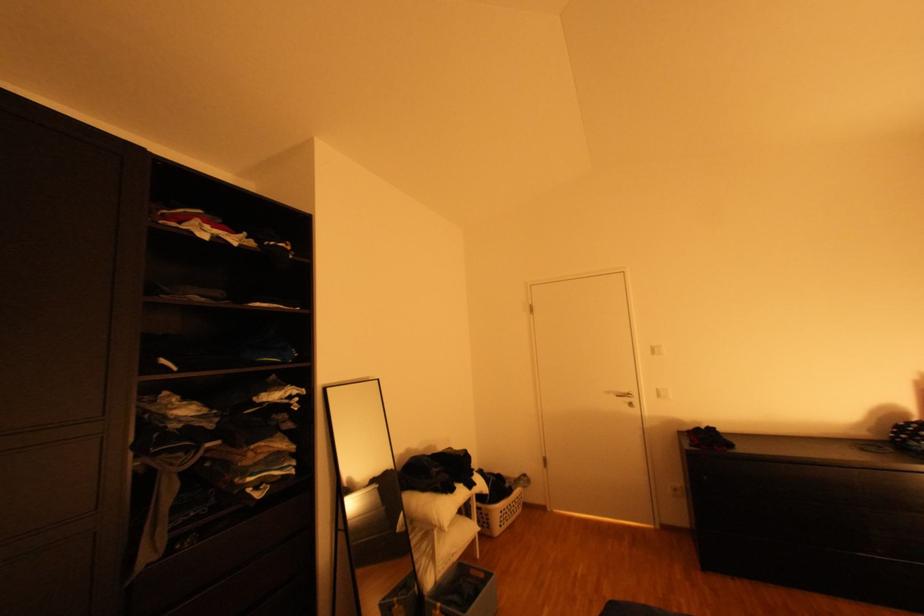
Find where to lift the white laundry basket. Please return your answer as a coordinate pair (x, y).

(497, 504)